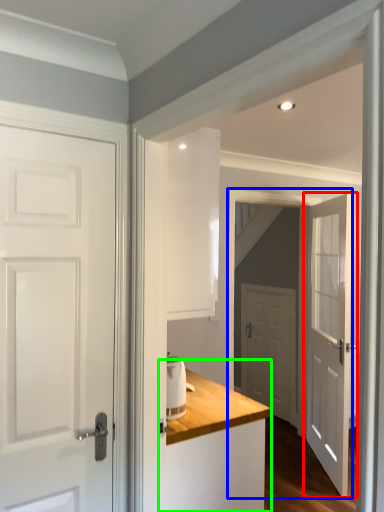
Question: Considering the real-world distances, which object is farthest from door (highlighted by a red box)? screen door (highlighted by a blue box) or dresser (highlighted by a green box)?

Choices:
 (A) screen door
 (B) dresser

Answer: (B)